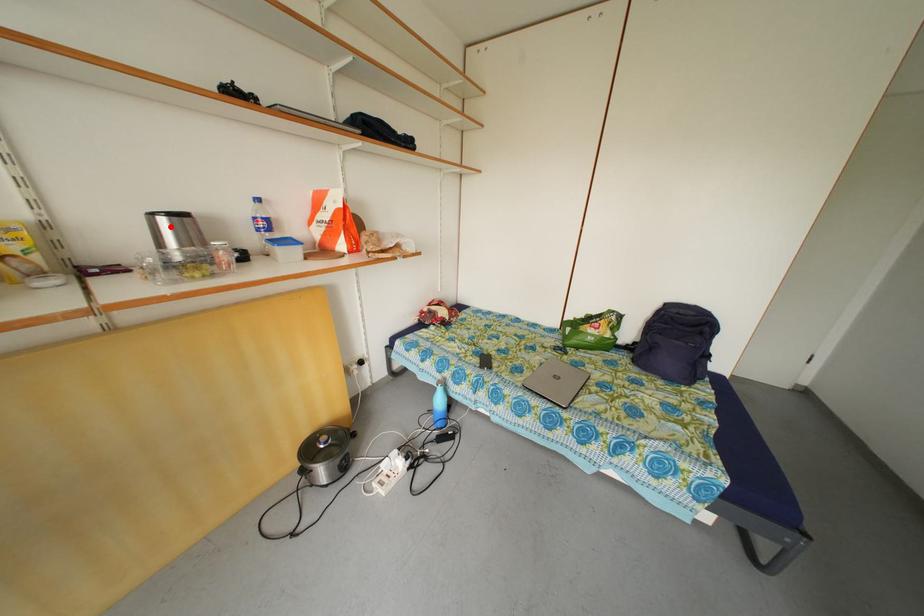
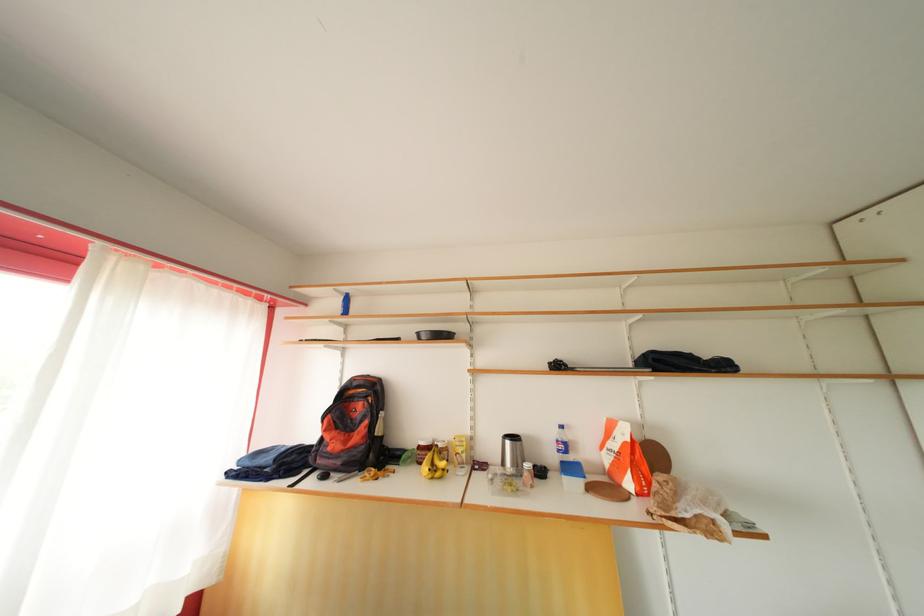
Question: I am providing you with two images of the same scene from different viewpoints. A red point is marked on the first image. Can you still see the location of the red point in image 2?

Choices:
 (A) Yes
 (B) No

Answer: (A)